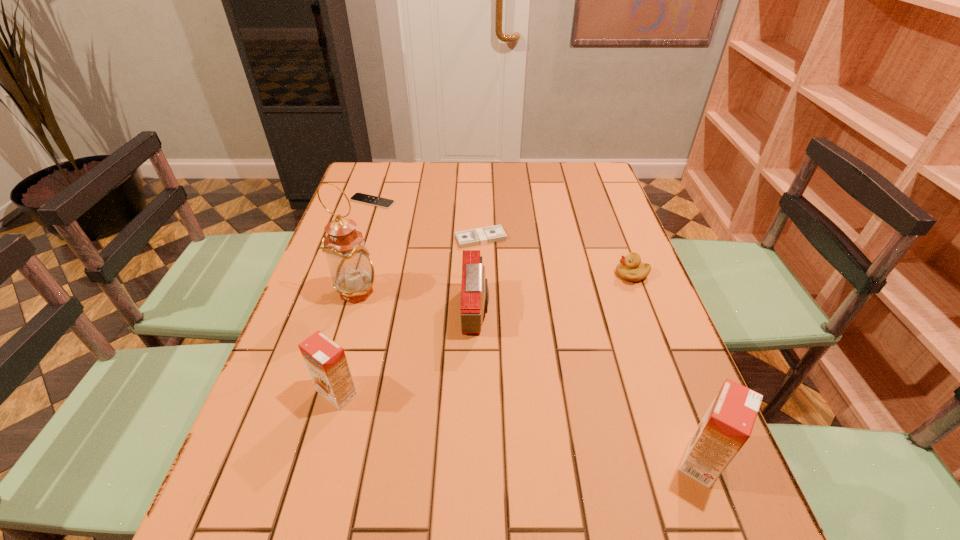
The height and width of the screenshot is (540, 960). In the image, there is a desktop. In order to click on free space at the near edge in this screenshot , I will do `click(406, 483)`.

Where is `free space at the left edge of the desktop`? free space at the left edge of the desktop is located at coordinates (356, 213).

What are the coordinates of `free space at the right edge` in the screenshot? It's located at (668, 368).

The width and height of the screenshot is (960, 540). In the image, there is a desktop. Find the location of `vacant space at the near right corner`. vacant space at the near right corner is located at coordinates (674, 454).

This screenshot has height=540, width=960. Identify the location of free spot between the third tallest object and the third shortest object. (485, 334).

Identify the location of vacant space that is in between the sixth nearest object and the second tallest object. (591, 349).

This screenshot has width=960, height=540. I want to click on free space that is in between the shortest object and the fourth tallest object, so click(x=424, y=256).

Locate an element on the screen. free space between the fourth shortest object and the duckling is located at coordinates (554, 293).

Find the location of a particular element. empty space that is in between the second farthest object and the tallest object is located at coordinates (420, 265).

At what (x,y) coordinates should I click in order to perform the action: click on free spot between the remote control and the right orange juice. Please return your answer as a coordinate pair (x, y). Looking at the image, I should click on (537, 330).